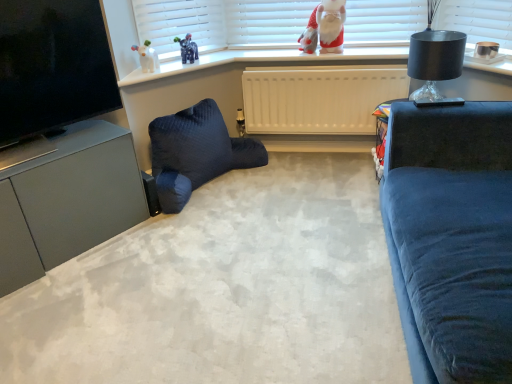
You are a GUI agent. You are given a task and a screenshot of the screen. Output one action in this format:
    pyautogui.click(x=<x>, y=<y>)
    Task: Click on the vacant space in matte black tv at left (from a real-world perspective)
    This screenshot has height=384, width=512.
    Given the screenshot: What is the action you would take?
    pyautogui.click(x=74, y=136)